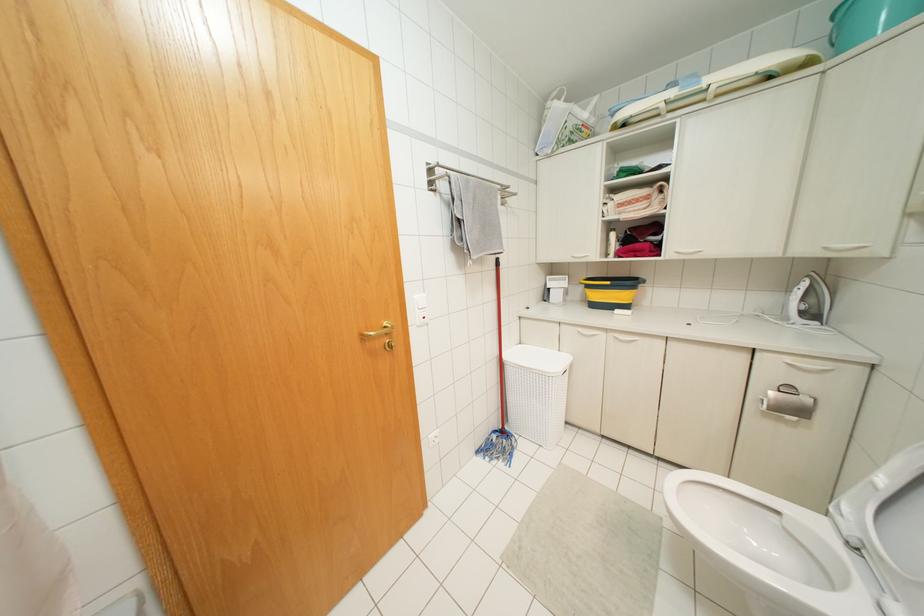
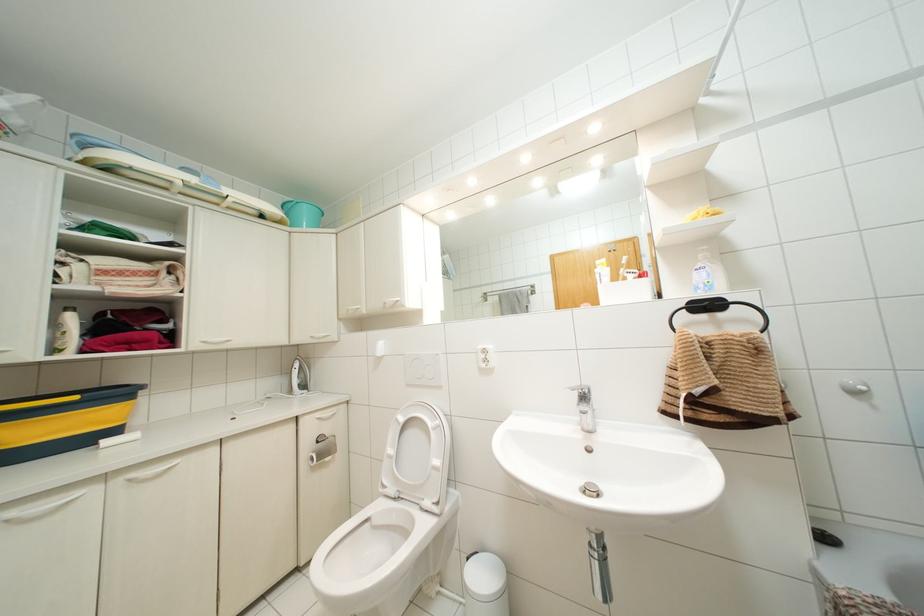
Find the pixel in the second image that matches point 608,283 in the first image.

(75, 397)